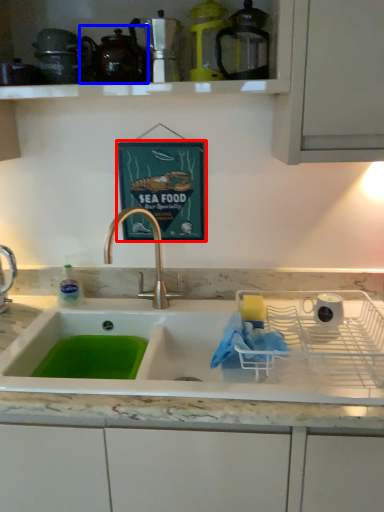
Question: Which object appears farthest to the camera in this image, picture frame (highlighted by a red box) or tea pot (highlighted by a blue box)?

Choices:
 (A) picture frame
 (B) tea pot

Answer: (A)